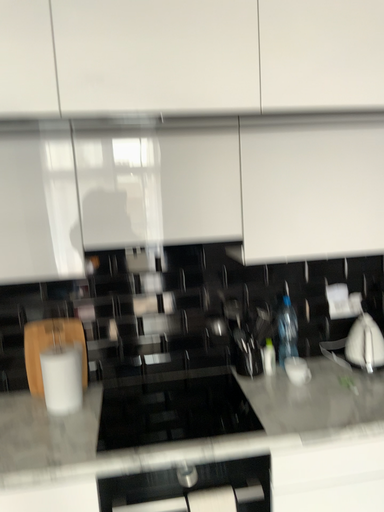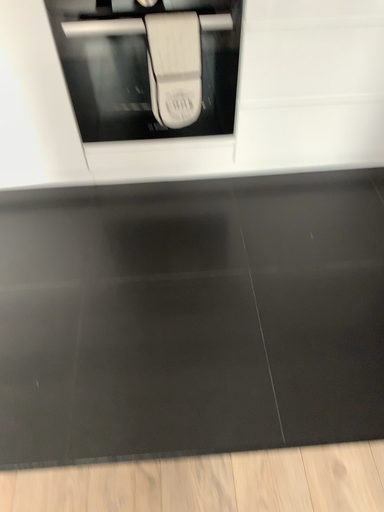
Question: Which way did the camera rotate in the video?

Choices:
 (A) rotated downward
 (B) rotated upward

Answer: (A)